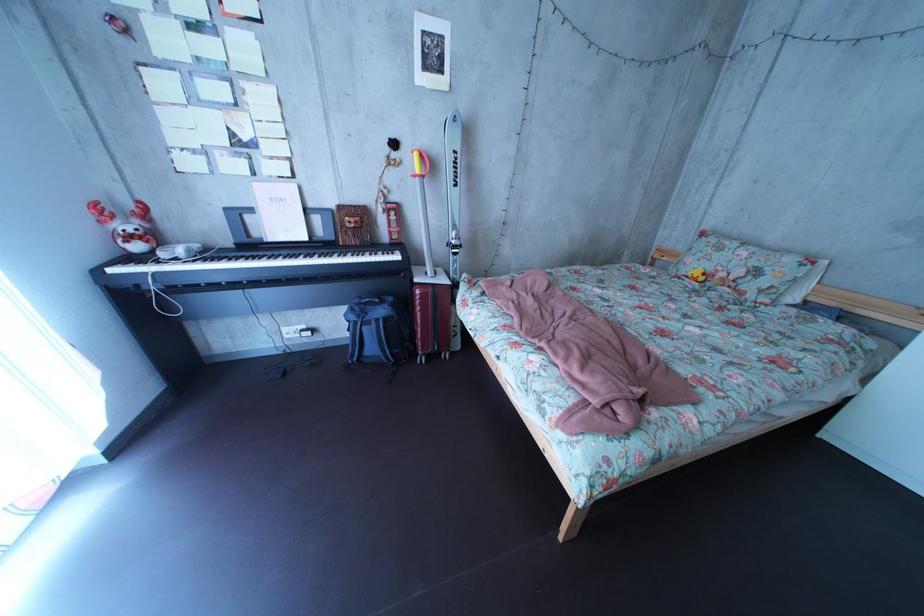
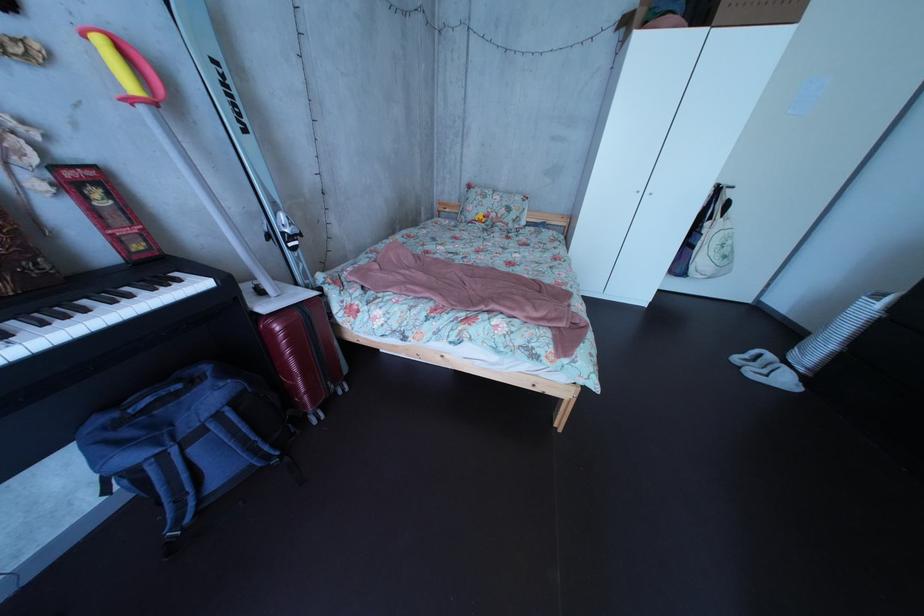
Where in the second image is the point corresponding to point 431,161 from the first image?

(116, 51)